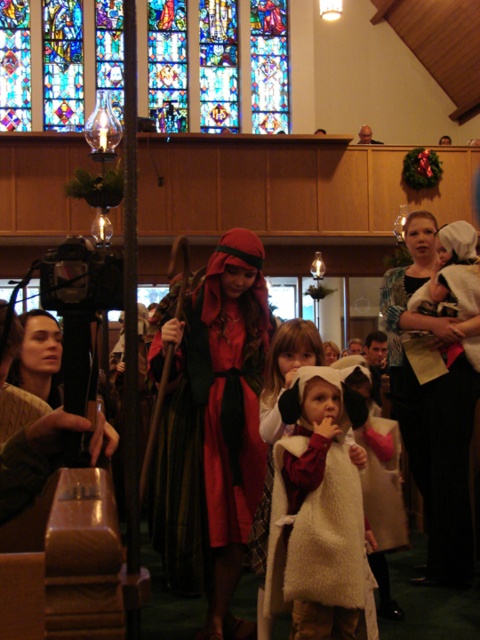
You are an event planner setting up a photo booth for a Christmas event. You have two props available here, the velvet red robe at center and the white fluffy coat at center. If you want to choose the wider prop to ensure it covers a large group photo backdrop, which one should you pick?

The velvet red robe at center has a larger width than the white fluffy coat at center, so you should choose the velvet red robe at center to cover the large group photo backdrop.

You are standing in the church and want to place a small decoration between the two points, point 1 at point (244,477) and point 2 at point (388,273). Which point is closer to you so that you can reach it easily?

Point (244,477) is closer to the camera than point (388,273), so you can reach it easily.